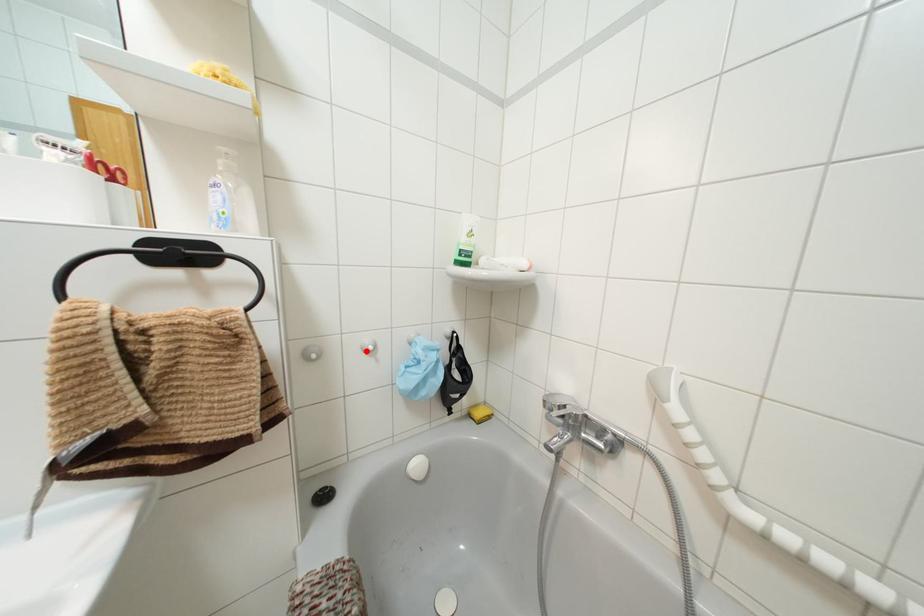
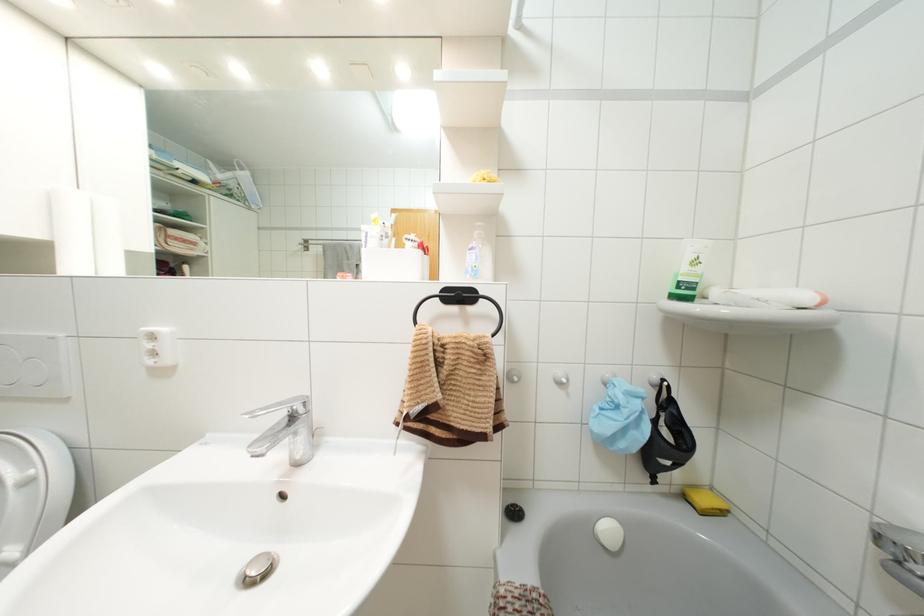
The point at the highlighted location is marked in the first image. Where is the corresponding point in the second image?

(558, 383)